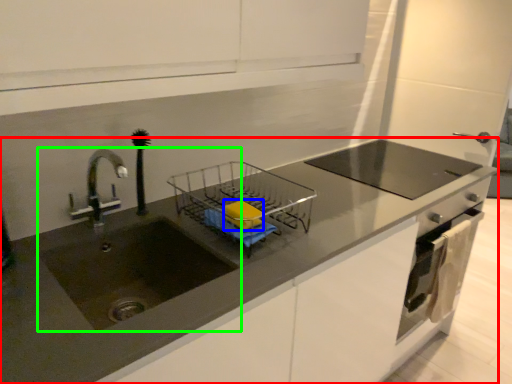
Question: Based on their relative distances, which object is nearer to countertop (highlighted by a red box)? Choose from soap (highlighted by a blue box) and sink (highlighted by a green box).

Choices:
 (A) soap
 (B) sink

Answer: (B)